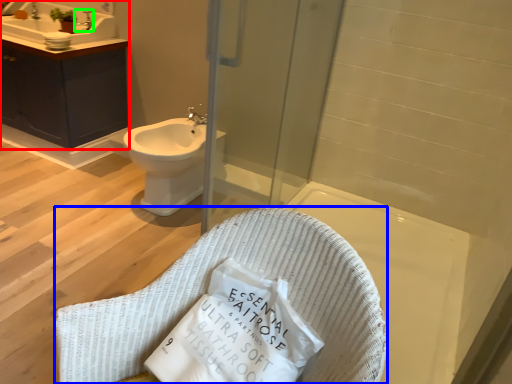
Question: Estimate the real-world distances between objects in this image. Which object is farther from bathroom cabinet (highlighted by a red box), rocking chair (highlighted by a blue box) or faucet (highlighted by a green box)?

Choices:
 (A) rocking chair
 (B) faucet

Answer: (A)